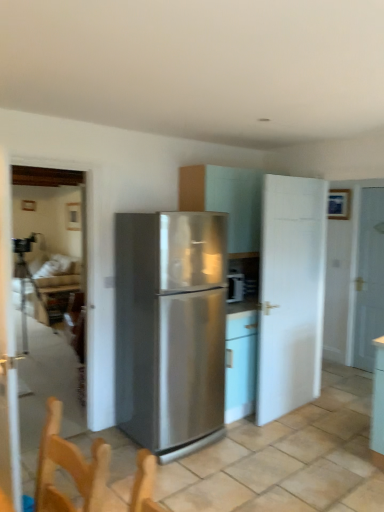
At what (x,y) coordinates should I click in order to perform the action: click on free point below white matte door at center-right, acting as the 1th door starting from the front (from a real-world perspective). Please return your answer as a coordinate pair (x, y). The height and width of the screenshot is (512, 384). Looking at the image, I should click on (284, 413).